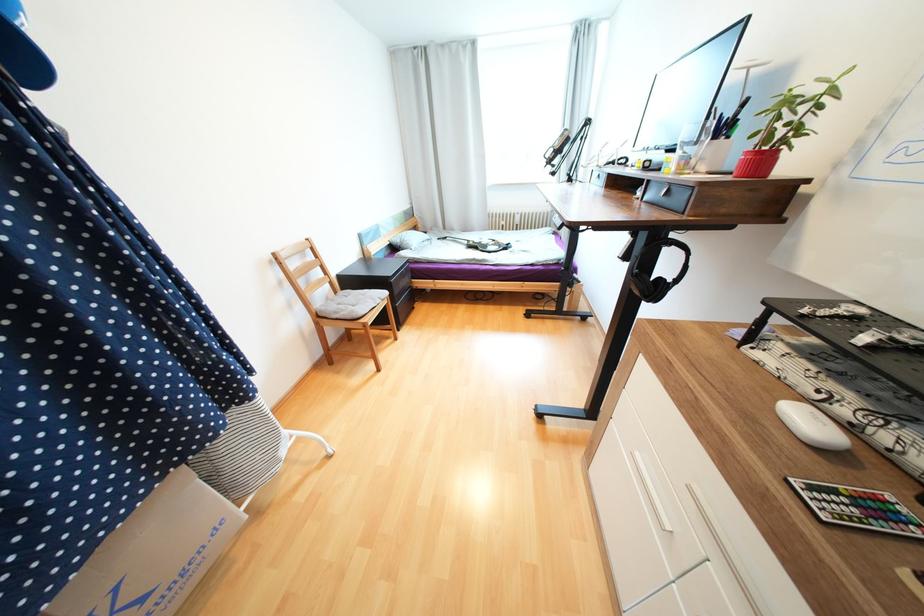
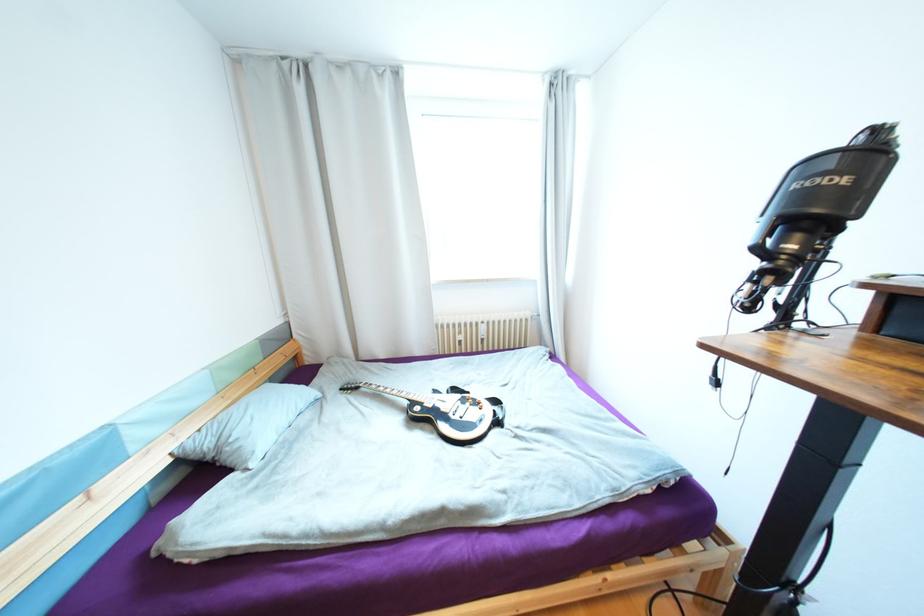
Question: The images are taken continuously from a first-person perspective. In which direction are you moving?

Choices:
 (A) Left
 (B) Right
 (C) Forward
 (D) Backward

Answer: (C)